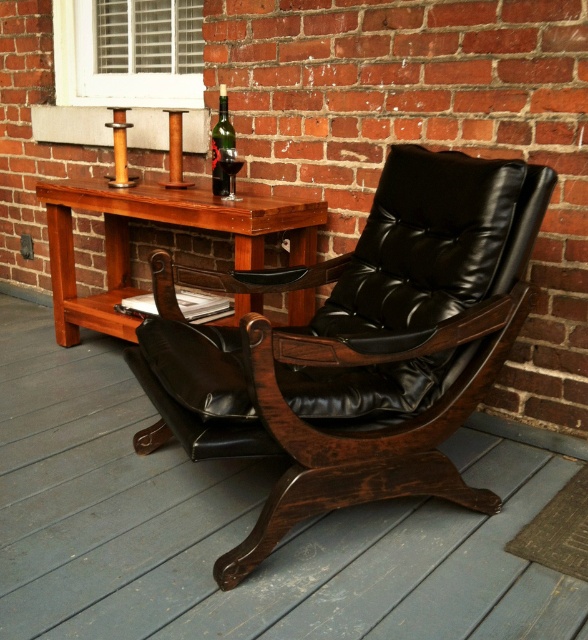
Question: Is dark brown wood chair at center above black leather chair at center?

Choices:
 (A) yes
 (B) no

Answer: (B)

Question: Among these points, which one is farthest from the camera?

Choices:
 (A) (58, 202)
 (B) (505, 291)
 (C) (4, 488)

Answer: (A)

Question: Can you confirm if dark brown wood chair at center is positioned below black leather chair at center?

Choices:
 (A) yes
 (B) no

Answer: (A)

Question: Among these points, which one is nearest to the camera?

Choices:
 (A) (166, 202)
 (B) (479, 387)

Answer: (B)

Question: Among these points, which one is farthest from the camera?

Choices:
 (A) (118, 269)
 (B) (155, 572)

Answer: (A)

Question: Is dark brown wood chair at center to the right of black leather chair at center from the viewer's perspective?

Choices:
 (A) yes
 (B) no

Answer: (B)